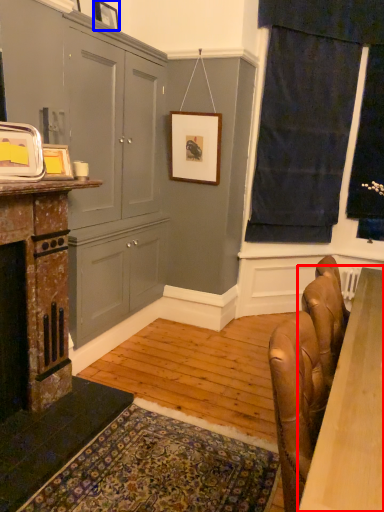
Question: Which point is further to the camera, table (highlighted by a red box) or picture frame (highlighted by a blue box)?

Choices:
 (A) table
 (B) picture frame

Answer: (B)